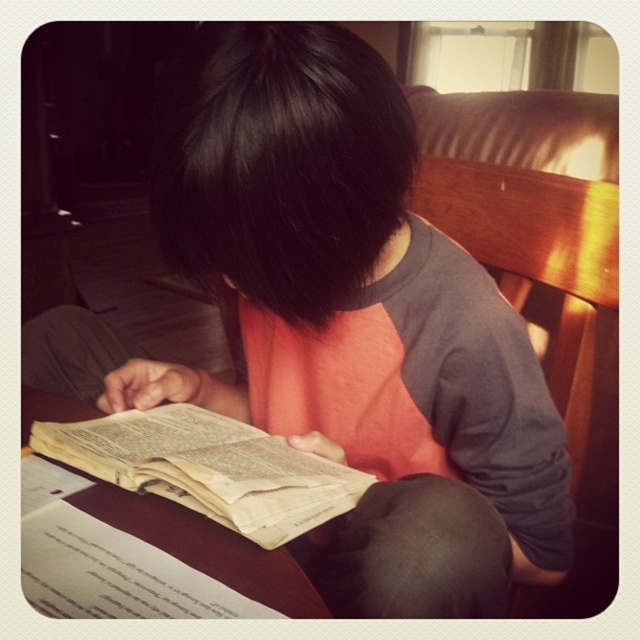
Does wooden chair at right have a lesser height compared to yellowish paper book at center?

Incorrect, wooden chair at right's height does not fall short of yellowish paper book at center's.

Is wooden chair at right further to the viewer compared to yellowish paper book at center?

Yes, it is behind yellowish paper book at center.

Is point (502, 234) farther from viewer compared to point (252, 497)?

That is True.

This screenshot has width=640, height=640. What are the coordinates of `wooden chair at right` in the screenshot? It's located at (556, 324).

Does yellowish paper book at center have a smaller size compared to black fabric at lower center?

Indeed, yellowish paper book at center has a smaller size compared to black fabric at lower center.

You are a GUI agent. You are given a task and a screenshot of the screen. Output one action in this format:
    pyautogui.click(x=<x>, y=<y>)
    Task: Click on the yellowish paper book at center
    The image size is (640, 640).
    Given the screenshot: What is the action you would take?
    pyautogui.click(x=209, y=468)

Is wooden chair at right shorter than black fabric at lower center?

No, wooden chair at right is not shorter than black fabric at lower center.

Locate an element on the screen. Image resolution: width=640 pixels, height=640 pixels. wooden chair at right is located at coordinates (556, 324).